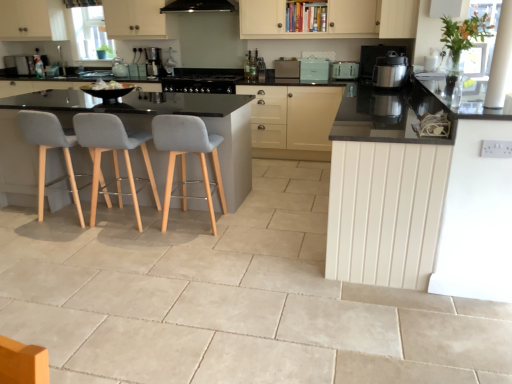
Question: From a real-world perspective, is light gray fabric chair at left, which appears as the 2th chair when viewed from the left, on top of white wood counter at right?

Choices:
 (A) no
 (B) yes

Answer: (A)

Question: Can you confirm if light gray fabric chair at left, which appears as the 2th chair when viewed from the left, is shorter than white wood counter at right?

Choices:
 (A) no
 (B) yes

Answer: (B)

Question: Does light gray fabric chair at left, which appears as the 2th chair when viewed from the left, have a larger size compared to white wood counter at right?

Choices:
 (A) no
 (B) yes

Answer: (A)

Question: From the image's perspective, does light gray fabric chair at left, which appears as the 2th chair when viewed from the left, appear lower than white wood counter at right?

Choices:
 (A) no
 (B) yes

Answer: (B)

Question: Can you confirm if light gray fabric chair at left, which appears as the 2th chair when viewed from the left, is taller than white wood counter at right?

Choices:
 (A) no
 (B) yes

Answer: (A)

Question: Is matte teal toaster at center, arranged as the second appliance when viewed from the left, situated inside white plastic toaster at upper center, which is the second kitchen appliance in front-to-back order, or outside?

Choices:
 (A) inside
 (B) outside

Answer: (B)

Question: From a real-world perspective, is matte teal toaster at center, arranged as the second appliance when viewed from the left, positioned above or below white plastic toaster at upper center, the 1th kitchen appliance in the top-to-bottom sequence?

Choices:
 (A) above
 (B) below

Answer: (A)

Question: Considering the relative positions of matte teal toaster at center, which appears as the 2th appliance when viewed from the right, and white plastic toaster at upper center, which is the second kitchen appliance in front-to-back order, in the image provided, is matte teal toaster at center, which appears as the 2th appliance when viewed from the right, to the left or to the right of white plastic toaster at upper center, which is the second kitchen appliance in front-to-back order,?

Choices:
 (A) right
 (B) left

Answer: (B)

Question: In the image, is matte teal toaster at center, which appears as the 2th appliance when viewed from the right, positioned in front of or behind white plastic toaster at upper center, which is the second kitchen appliance in front-to-back order?

Choices:
 (A) front
 (B) behind

Answer: (B)

Question: Is satin silver pressure cooker at right, which is the second kitchen appliance in back-to-front order, to the left or to the right of clear glass window screen at upper left in the image?

Choices:
 (A) left
 (B) right

Answer: (B)

Question: Is satin silver pressure cooker at right, the 2th kitchen appliance viewed from the top, bigger or smaller than clear glass window screen at upper left?

Choices:
 (A) small
 (B) big

Answer: (B)

Question: Considering the positions of satin silver pressure cooker at right, placed as the first kitchen appliance when sorted from front to back, and clear glass window screen at upper left in the image, is satin silver pressure cooker at right, placed as the first kitchen appliance when sorted from front to back, taller or shorter than clear glass window screen at upper left?

Choices:
 (A) short
 (B) tall

Answer: (A)

Question: Considering the positions of point (376, 59) and point (90, 59), is point (376, 59) closer or farther from the camera than point (90, 59)?

Choices:
 (A) farther
 (B) closer

Answer: (B)

Question: From the image's perspective, is white wood counter at right located above or below satin silver pressure cooker at right, the 2th kitchen appliance viewed from the top?

Choices:
 (A) below
 (B) above

Answer: (A)

Question: Considering the positions of white wood counter at right and satin silver pressure cooker at right, placed as the first kitchen appliance when sorted from front to back, in the image, is white wood counter at right wider or thinner than satin silver pressure cooker at right, placed as the first kitchen appliance when sorted from front to back,?

Choices:
 (A) thin
 (B) wide

Answer: (B)